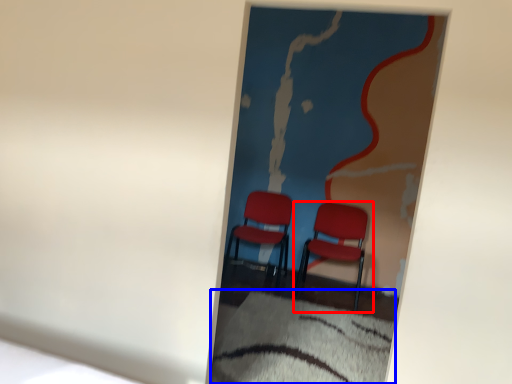
Question: Which object is further to the camera taking this photo, chair (highlighted by a red box) or sheet (highlighted by a blue box)?

Choices:
 (A) chair
 (B) sheet

Answer: (A)